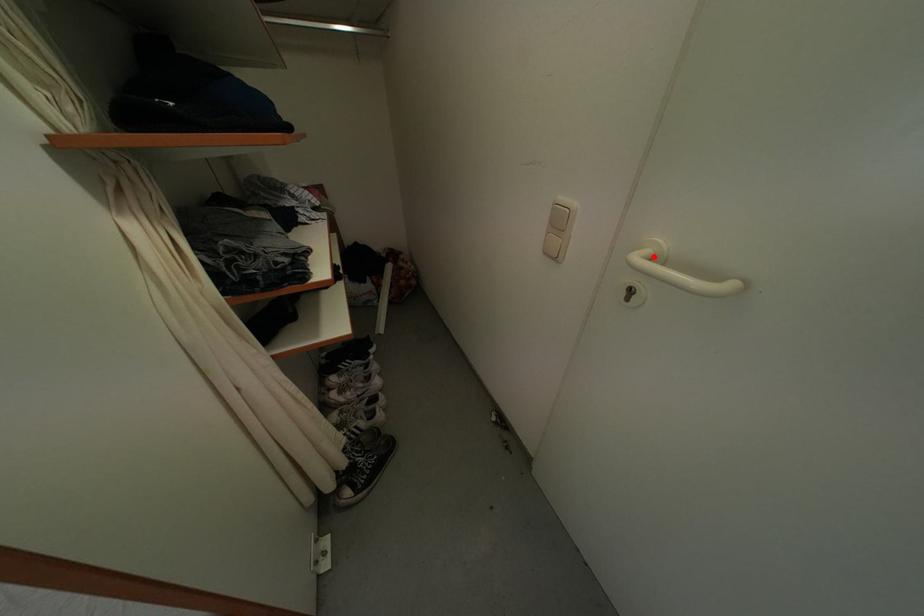
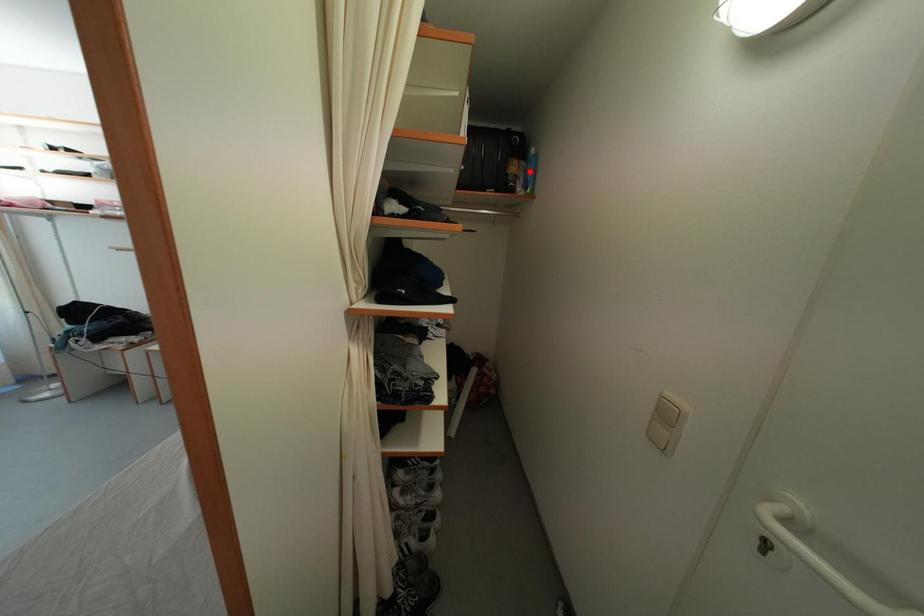
I am providing you with two images of the same scene from different viewpoints. A red point is marked on the first image and another point is marked on the second image. Does the point marked in image1 correspond to the same location as the one in image2?

No